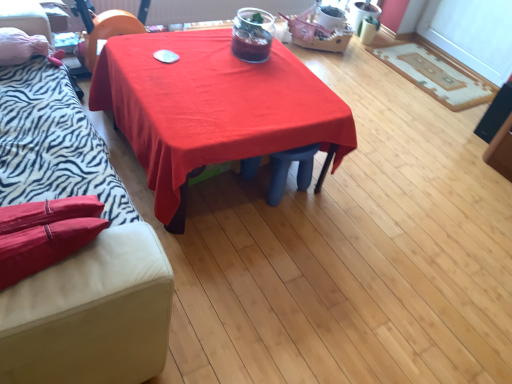
Question: Does beige textured rug at right have a greater width compared to red fabric table at center?

Choices:
 (A) yes
 (B) no

Answer: (B)

Question: Is beige textured rug at right closer to camera compared to red fabric table at center?

Choices:
 (A) no
 (B) yes

Answer: (A)

Question: Is beige textured rug at right surrounding red fabric table at center?

Choices:
 (A) yes
 (B) no

Answer: (B)

Question: Considering the relative sizes of beige textured rug at right and red fabric table at center in the image provided, is beige textured rug at right bigger than red fabric table at center?

Choices:
 (A) no
 (B) yes

Answer: (A)

Question: From the image's perspective, is beige textured rug at right under red fabric table at center?

Choices:
 (A) no
 (B) yes

Answer: (A)

Question: Is red fabric table at center in front of or behind beige textured rug at right in the image?

Choices:
 (A) behind
 (B) front

Answer: (B)

Question: From their relative heights in the image, would you say red fabric table at center is taller or shorter than beige textured rug at right?

Choices:
 (A) tall
 (B) short

Answer: (A)

Question: Considering the positions of point (290, 127) and point (465, 77), is point (290, 127) closer or farther from the camera than point (465, 77)?

Choices:
 (A) farther
 (B) closer

Answer: (B)

Question: Is red fabric table at center spatially inside beige textured rug at right, or outside of it?

Choices:
 (A) outside
 (B) inside

Answer: (A)

Question: From the image's perspective, is zebra print fabric couch at left located above or below red fabric table at center?

Choices:
 (A) above
 (B) below

Answer: (B)

Question: Is zebra print fabric couch at left situated inside red fabric table at center or outside?

Choices:
 (A) outside
 (B) inside

Answer: (A)

Question: Looking at their shapes, would you say zebra print fabric couch at left is wider or thinner than red fabric table at center?

Choices:
 (A) thin
 (B) wide

Answer: (A)

Question: Considering the positions of zebra print fabric couch at left and red fabric table at center in the image, is zebra print fabric couch at left taller or shorter than red fabric table at center?

Choices:
 (A) tall
 (B) short

Answer: (A)

Question: Relative to zebra print fabric couch at left, is red fabric table at center in front or behind?

Choices:
 (A) front
 (B) behind

Answer: (B)

Question: Visually, is red fabric table at center positioned to the left or to the right of zebra print fabric couch at left?

Choices:
 (A) right
 (B) left

Answer: (A)